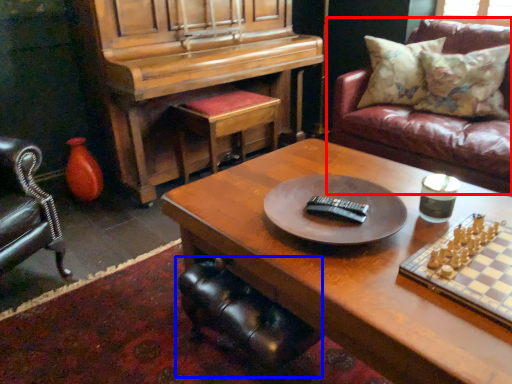
Question: Which point is closer to the camera, studio couch (highlighted by a red box) or swivel chair (highlighted by a blue box)?

Choices:
 (A) studio couch
 (B) swivel chair

Answer: (B)